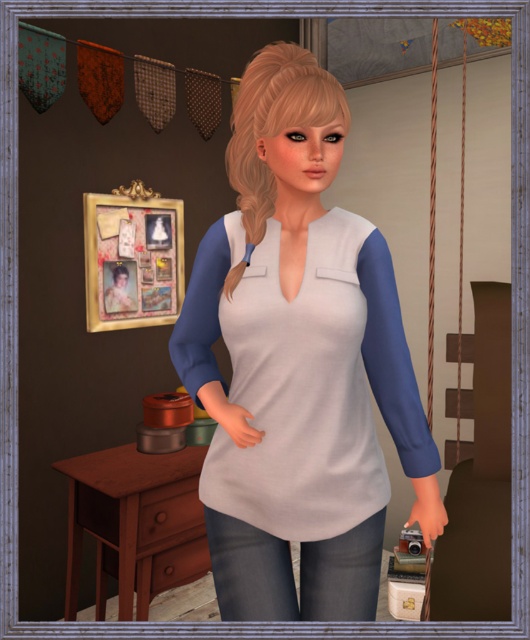
Question: From the image, what is the correct spatial relationship of white matte dress at center in relation to denim jeans at lower center?

Choices:
 (A) below
 (B) above

Answer: (B)

Question: Which is nearer to the denim jeans at lower center?

Choices:
 (A) white matte dress at center
 (B) matte white fabric shirt at center

Answer: (B)

Question: Can you confirm if brown wood dresser at lower left is positioned to the left of denim jeans at lower center?

Choices:
 (A) yes
 (B) no

Answer: (A)

Question: Estimate the real-world distances between objects in this image. Which object is closer to the brown wood dresser at lower left?

Choices:
 (A) matte white fabric shirt at center
 (B) white matte dress at center
 (C) denim jeans at lower center

Answer: (C)

Question: Which point is closer to the camera?

Choices:
 (A) white matte dress at center
 (B) matte white fabric shirt at center
 (C) denim jeans at lower center
 (D) brown wood dresser at lower left

Answer: (B)

Question: Is white matte dress at center smaller than brown wood dresser at lower left?

Choices:
 (A) no
 (B) yes

Answer: (B)